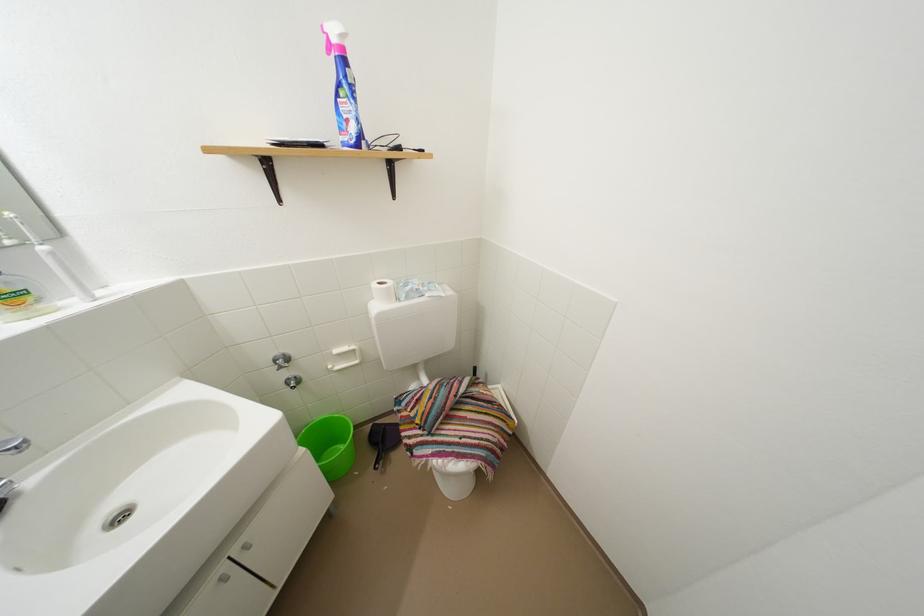
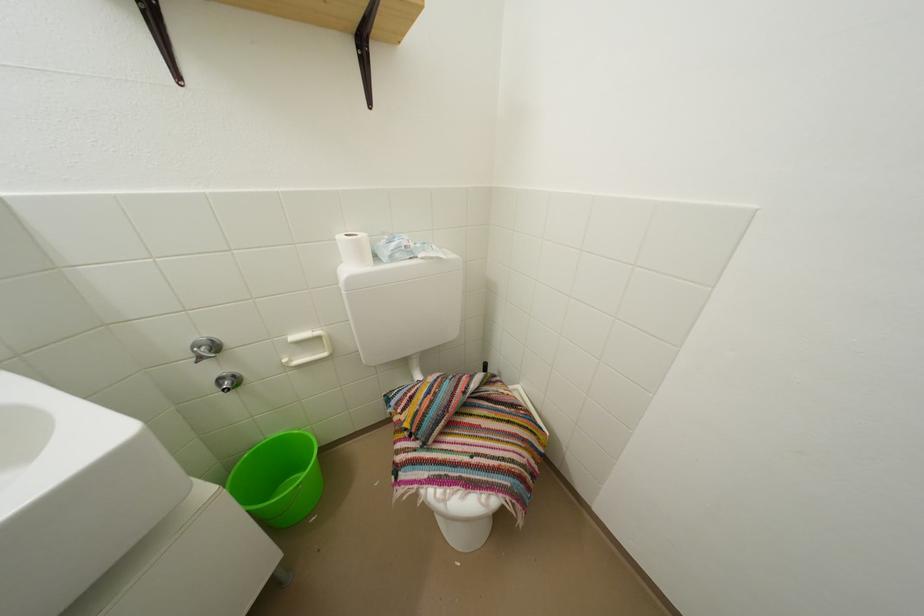
Question: What movement of the cameraman would produce the second image?

Choices:
 (A) Left
 (B) Right
 (C) Forward
 (D) Backward

Answer: (C)